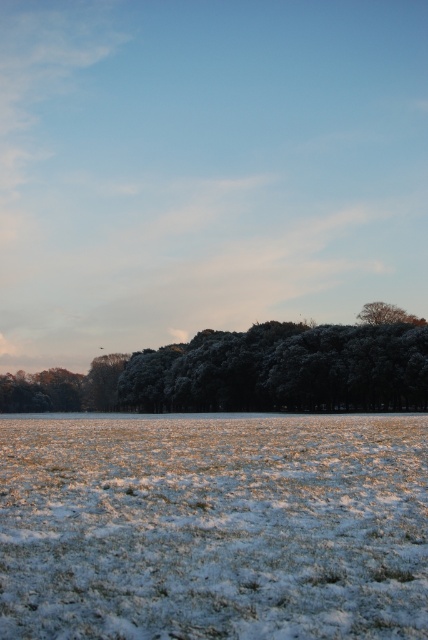
Can you confirm if white frosty grass at center is shorter than frosted green trees at center?

Yes, white frosty grass at center is shorter than frosted green trees at center.

Between white frosty grass at center and frosted green trees at center, which one has more height?

Standing taller between the two is frosted green trees at center.

Where is `white frosty grass at center`? The height and width of the screenshot is (640, 428). white frosty grass at center is located at coordinates coord(213,525).